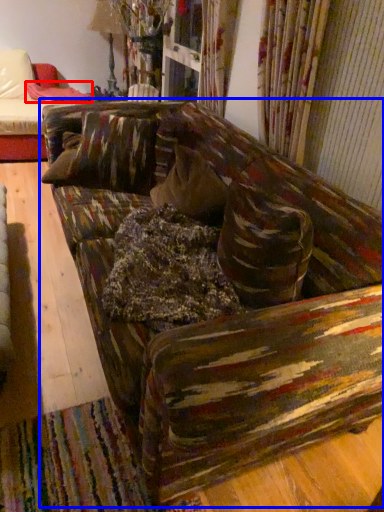
Question: Among these objects, which one is farthest to the camera, blanket (highlighted by a red box) or studio couch (highlighted by a blue box)?

Choices:
 (A) blanket
 (B) studio couch

Answer: (A)